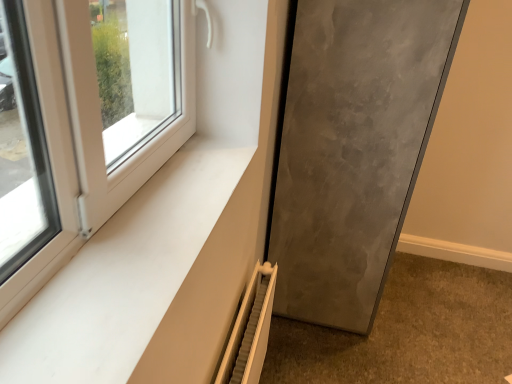
Question: Looking at the image, does matte gray door at lower right seem bigger or smaller compared to white textured radiator at lower center?

Choices:
 (A) big
 (B) small

Answer: (A)

Question: Is matte gray door at lower right spatially inside white textured radiator at lower center, or outside of it?

Choices:
 (A) outside
 (B) inside

Answer: (A)

Question: Which object is the farthest from the white textured radiator at lower center?

Choices:
 (A) white matte window sill at lower left
 (B) matte gray door at lower right

Answer: (B)

Question: Considering the real-world distances, which object is closest to the matte gray door at lower right?

Choices:
 (A) white matte window sill at lower left
 (B) white textured radiator at lower center

Answer: (B)